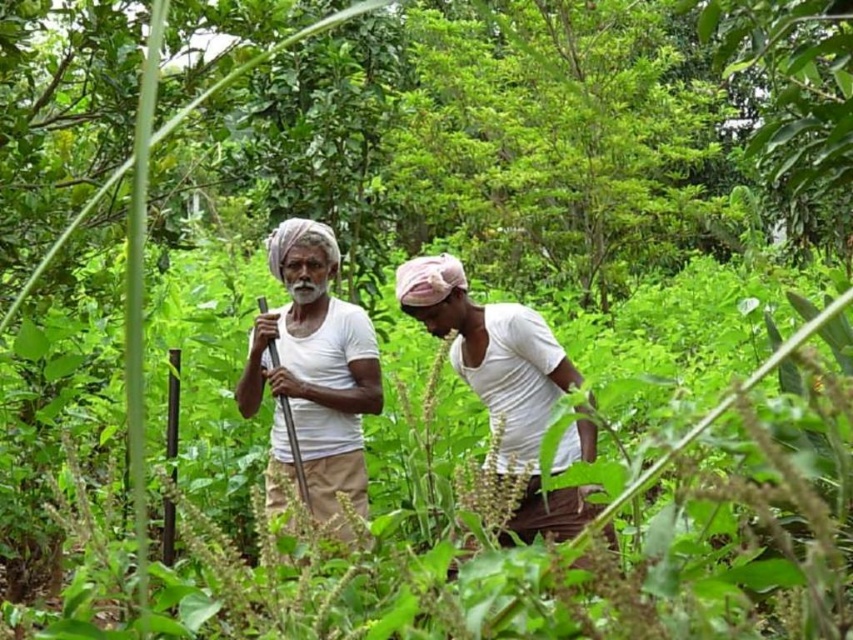
Between white cotton turban at center and white cotton shirt at center, which one appears on the left side from the viewer's perspective?

white cotton turban at center is more to the left.

Who is more forward, (361, 467) or (447, 300)?

Point (447, 300)

Between point (293, 324) and point (465, 298), which one is positioned behind?

Positioned behind is point (293, 324).

The image size is (853, 640). I want to click on white cotton turban at center, so click(312, 372).

Is green leafy tree at center bigger than white cotton turban at center?

No.

Can you confirm if green leafy tree at center is positioned above white cotton turban at center?

Correct, green leafy tree at center is located above white cotton turban at center.

This screenshot has height=640, width=853. Describe the element at coordinates (555, 141) in the screenshot. I see `green leafy tree at center` at that location.

Image resolution: width=853 pixels, height=640 pixels. Identify the location of green leafy tree at center. (555, 141).

Image resolution: width=853 pixels, height=640 pixels. Describe the element at coordinates (555, 141) in the screenshot. I see `green leafy tree at center` at that location.

Who is more distant from viewer, (683, 124) or (498, 387)?

The point (683, 124) is behind.

Is point (613, 172) farther from camera compared to point (450, 289)?

Yes, point (613, 172) is behind point (450, 289).

Where is `green leafy tree at center`? This screenshot has width=853, height=640. green leafy tree at center is located at coordinates (555, 141).